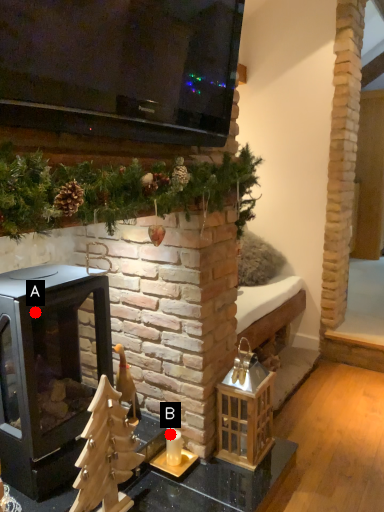
Question: Two points are circled on the image, labeled by A and B beside each circle. Which point is farther from the camera taking this photo?

Choices:
 (A) A is further
 (B) B is further

Answer: (B)